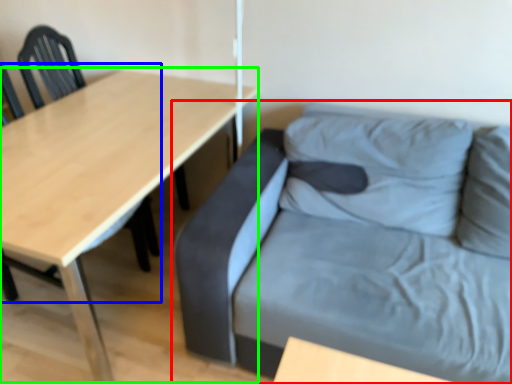
Question: Considering the real-world distances, which object is closest to studio couch (highlighted by a red box)? chair (highlighted by a blue box) or table (highlighted by a green box).

Choices:
 (A) chair
 (B) table

Answer: (B)